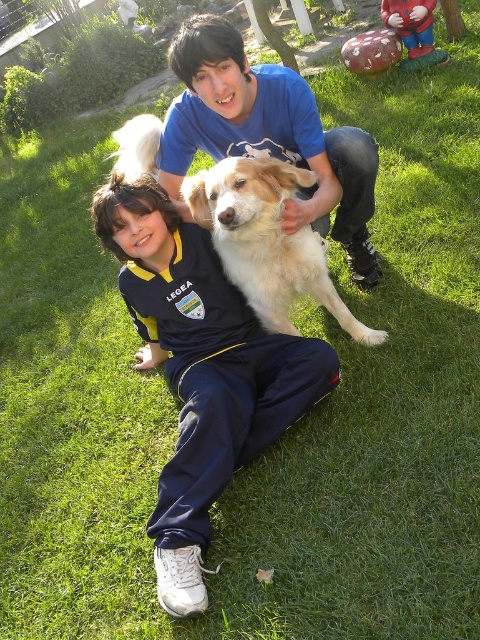
Consider the image. Measure the distance between dark blue track suit at center and camera.

dark blue track suit at center is 5.88 feet from camera.

The height and width of the screenshot is (640, 480). In order to click on dark blue track suit at center in this screenshot , I will do `click(201, 371)`.

Who is taller, smooth blue shirt at center or golden fur dog at center?

smooth blue shirt at center is taller.

Does smooth blue shirt at center lie behind golden fur dog at center?

Yes, it is behind golden fur dog at center.

Does point (218, 17) lie behind point (339, 298)?

Yes.

Locate an element on the screen. The width and height of the screenshot is (480, 640). smooth blue shirt at center is located at coordinates (267, 134).

Which is behind, point (175, 276) or point (284, 282)?

Positioned behind is point (175, 276).

Find the location of `dark blue track suit at center`. dark blue track suit at center is located at coordinates (201, 371).

Identify the location of dark blue track suit at center. Image resolution: width=480 pixels, height=640 pixels. (201, 371).